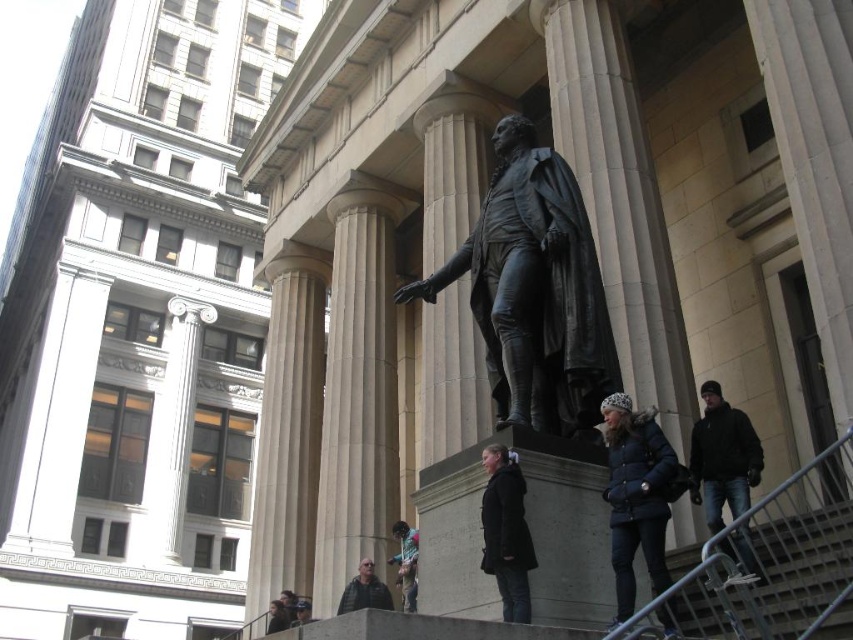
Question: Which object is the closest to the black leather jacket at lower right?

Choices:
 (A) smooth beige column at center
 (B) green fabric jacket at lower center

Answer: (B)

Question: Which point is closer to the camera?

Choices:
 (A) (492, 508)
 (B) (720, 577)
 (C) (616, 500)
 (D) (364, 593)

Answer: (B)

Question: Is metallic gray stair at lower right thinner than dark gray jacket at lower center?

Choices:
 (A) yes
 (B) no

Answer: (A)

Question: Which point is farther to the camera?

Choices:
 (A) green fabric jacket at lower center
 (B) metallic gray stair at lower right

Answer: (A)

Question: Does beige stone column at center come behind black wool coat at center?

Choices:
 (A) no
 (B) yes

Answer: (B)

Question: Observing the image, what is the correct spatial positioning of smooth stone column at center in reference to dark gray jacket at lower center?

Choices:
 (A) above
 (B) below

Answer: (A)